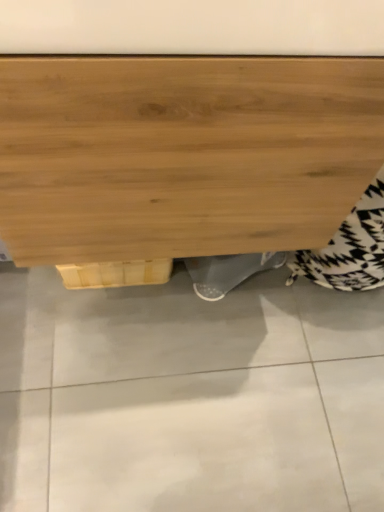
The height and width of the screenshot is (512, 384). What do you see at coordinates (180, 158) in the screenshot? I see `natural wood table at center` at bounding box center [180, 158].

At what (x,y) coordinates should I click in order to perform the action: click on natural wood table at center. Please return your answer as a coordinate pair (x, y). Looking at the image, I should click on (180, 158).

The width and height of the screenshot is (384, 512). Find the location of `natural wood table at center`. natural wood table at center is located at coordinates (180, 158).